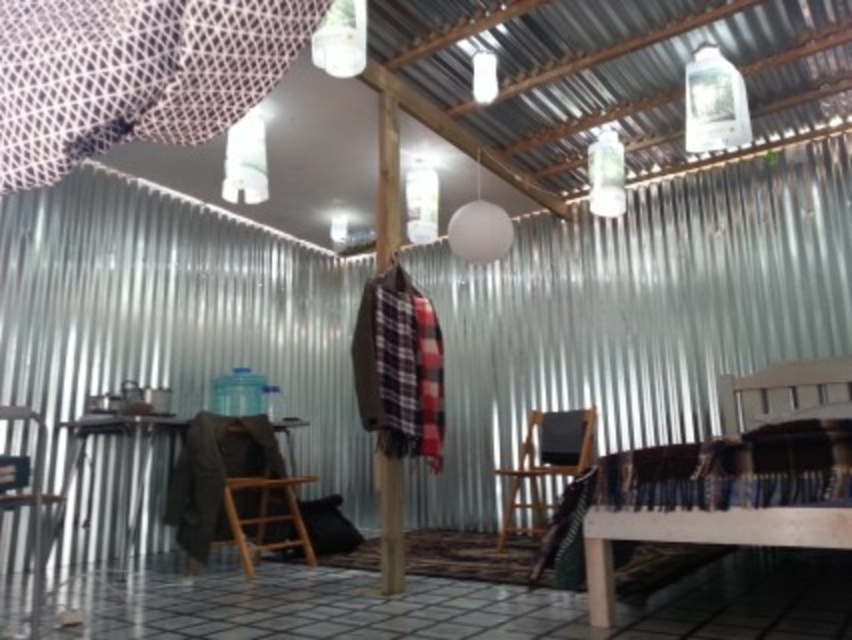
Question: Which of the following is the farthest from the observer?

Choices:
 (A) (589, 518)
 (B) (281, 61)
 (C) (329, 68)

Answer: (C)

Question: Does wooden bed at lower right have a greater width compared to translucent glass lampshade at upper center?

Choices:
 (A) no
 (B) yes

Answer: (B)

Question: Among these objects, which one is nearest to the camera?

Choices:
 (A) wooden chair at center
 (B) white mesh curtain at upper left
 (C) wooden chair at left

Answer: (B)

Question: Among these points, which one is nearest to the camera?

Choices:
 (A) (516, 484)
 (B) (237, 173)

Answer: (B)

Question: Is wooden bed at lower right smaller than brown wooden chair at lower left?

Choices:
 (A) no
 (B) yes

Answer: (B)

Question: Does white mesh curtain at upper left lie behind clear plastic bottle at upper right?

Choices:
 (A) no
 (B) yes

Answer: (A)